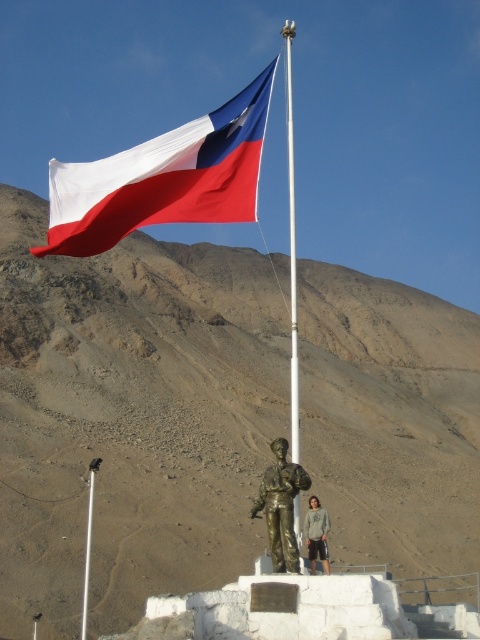
Does white metallic flag pole at center have a greater height compared to white metallic pole at center?

Indeed, white metallic flag pole at center has a greater height compared to white metallic pole at center.

Is white metallic flag pole at center to the left of white metallic pole at center from the viewer's perspective?

No, white metallic flag pole at center is not to the left of white metallic pole at center.

Who is more forward, [289,285] or [88,532]?

Point [88,532]

Where is `white metallic flag pole at center`? The height and width of the screenshot is (640, 480). white metallic flag pole at center is located at coordinates (291, 250).

Can you confirm if white metallic flag pole at center is thinner than gray cotton hoodie at center?

No.

Does white metallic flag pole at center come in front of gray cotton hoodie at center?

Yes, it is.

Does point (285, 36) lie behind point (328, 525)?

Yes, it is.

Locate an element on the screen. Image resolution: width=480 pixels, height=640 pixels. white metallic flag pole at center is located at coordinates (291, 250).

Is matte fabric flag at upper center bigger than bronze statue at center?

Indeed, matte fabric flag at upper center has a larger size compared to bronze statue at center.

Can you confirm if matte fabric flag at upper center is wider than bronze statue at center?

Indeed, matte fabric flag at upper center has a greater width compared to bronze statue at center.

Is point (225, 220) positioned in front of point (272, 493)?

No.

This screenshot has width=480, height=640. Find the location of `matte fabric flag at upper center`. matte fabric flag at upper center is located at coordinates (164, 179).